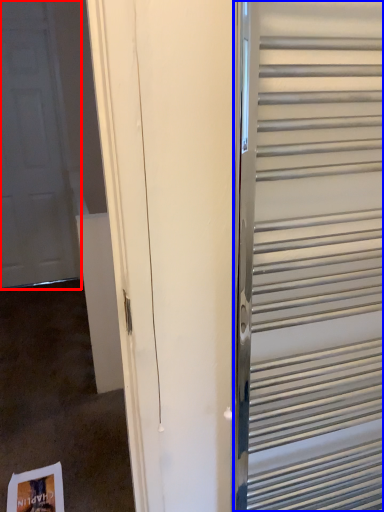
Question: Which of the following is the farthest to the observer, door (highlighted by a red box) or elevator (highlighted by a blue box)?

Choices:
 (A) door
 (B) elevator

Answer: (A)